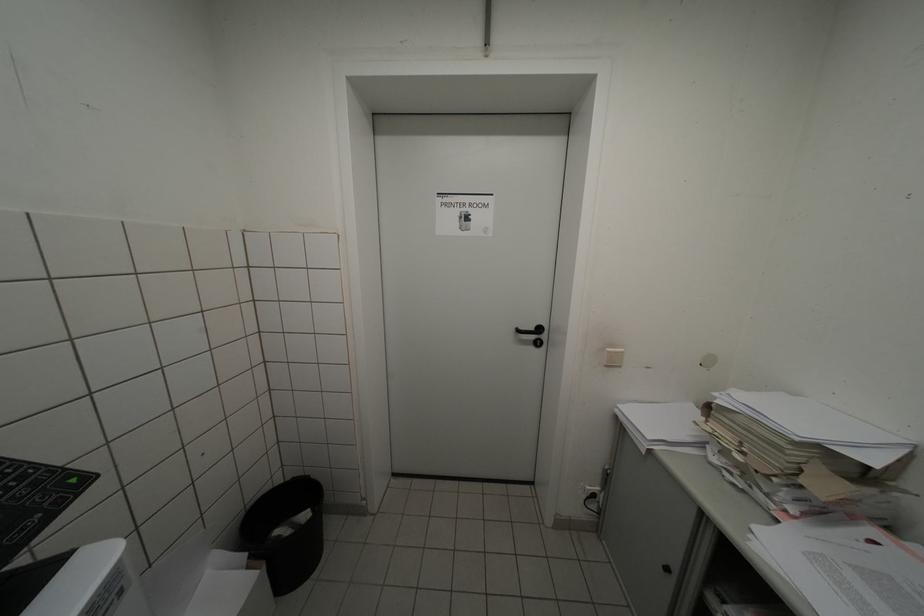
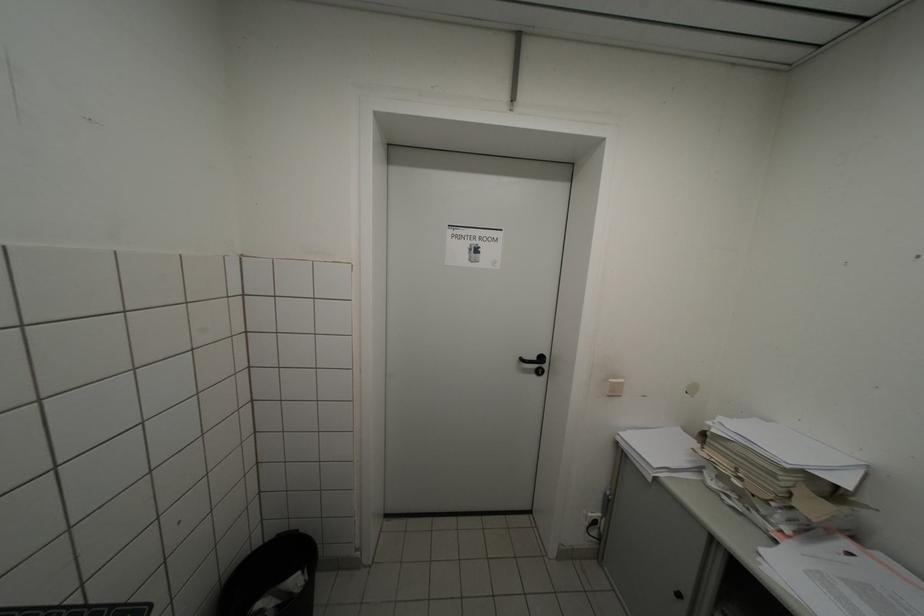
Question: In a continuous first-person perspective shot, in which direction is the camera moving?

Choices:
 (A) Left
 (B) Right
 (C) Forward
 (D) Backward

Answer: (A)